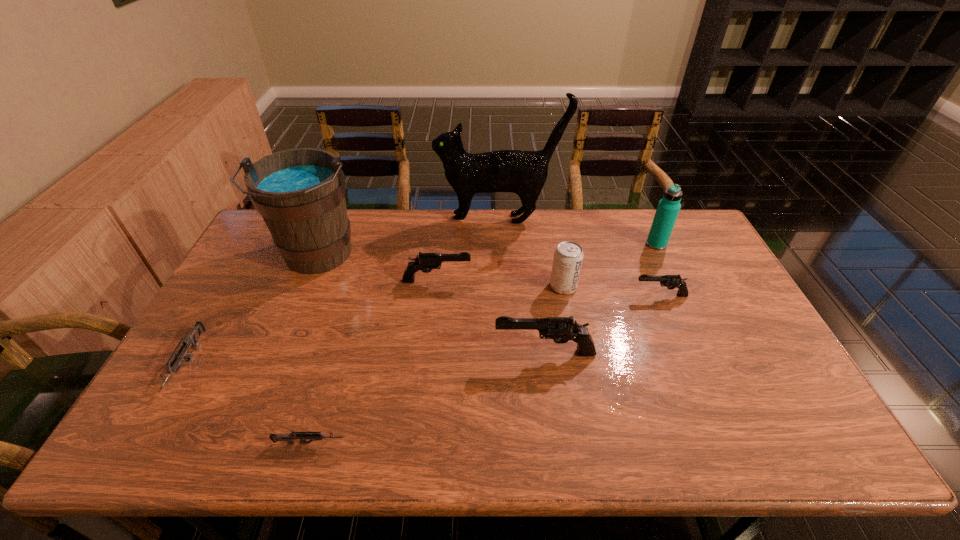
The width and height of the screenshot is (960, 540). I want to click on the third tallest gun, so click(x=671, y=282).

Where is `the smallest black gun`? the smallest black gun is located at coordinates (x=671, y=282).

Find the location of a particular element. The image size is (960, 540). the left grey gun is located at coordinates (192, 340).

Image resolution: width=960 pixels, height=540 pixels. What are the coordinates of `the leftmost object` in the screenshot? It's located at (192, 340).

Identify the location of the right grey gun. (314, 436).

This screenshot has height=540, width=960. In order to click on the second gun from left to right in this screenshot , I will do `click(314, 436)`.

Locate an element on the screen. Image resolution: width=960 pixels, height=540 pixels. free space located 0.370m on the face of the cat is located at coordinates (338, 219).

At what (x,y) coordinates should I click in order to perform the action: click on vacant space situated 0.210m on the face of the cat. Please return your answer as a coordinate pair (x, y). The width and height of the screenshot is (960, 540). Looking at the image, I should click on (381, 219).

At what (x,y) coordinates should I click in order to perform the action: click on vacant space positioned on the face of the cat. Please return your answer as a coordinate pair (x, y). The image size is (960, 540). Looking at the image, I should click on (335, 219).

Where is `vacant space situated with a handle on the side of the wine bucket`? vacant space situated with a handle on the side of the wine bucket is located at coordinates 283,340.